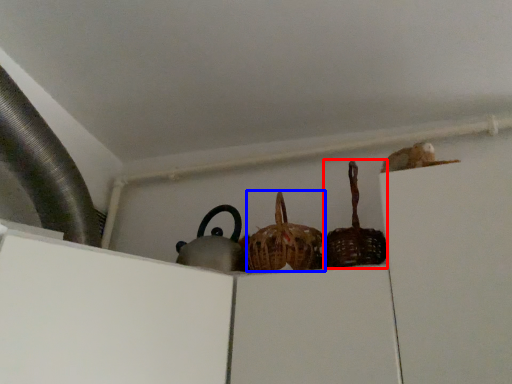
Question: Which object appears closest to the camera in this image, basket (highlighted by a red box) or basket (highlighted by a blue box)?

Choices:
 (A) basket
 (B) basket

Answer: (A)